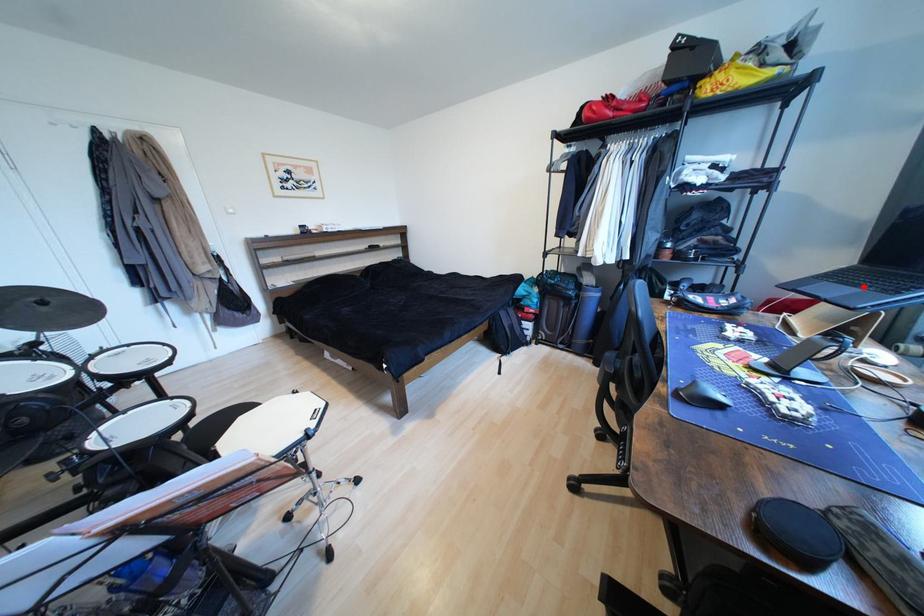
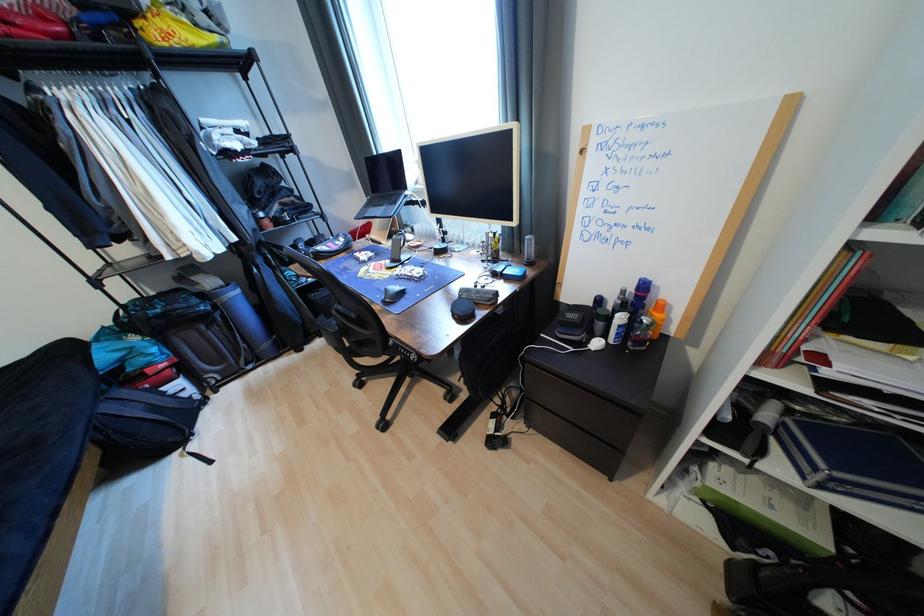
In the second image, find the point that corresponds to the highlighted location in the first image.

(388, 207)